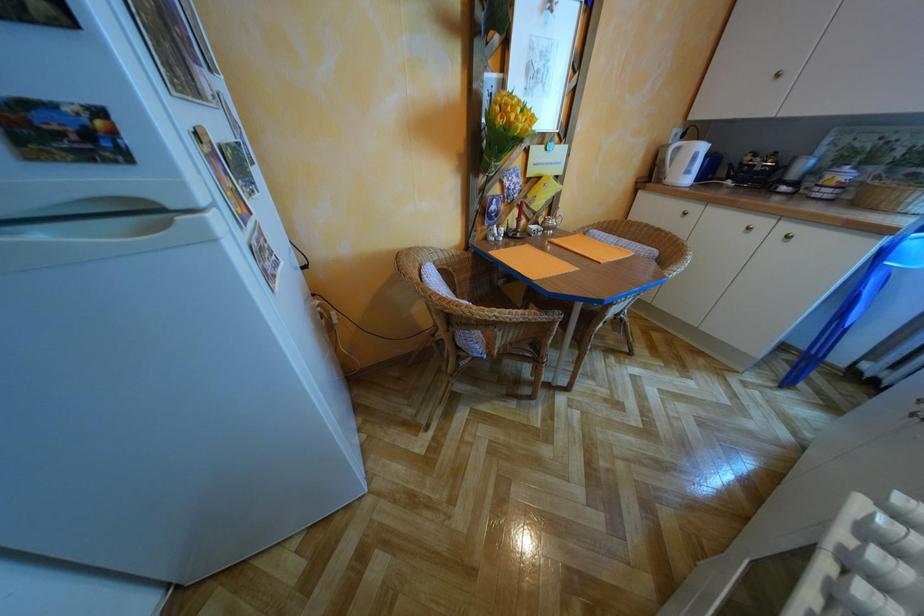
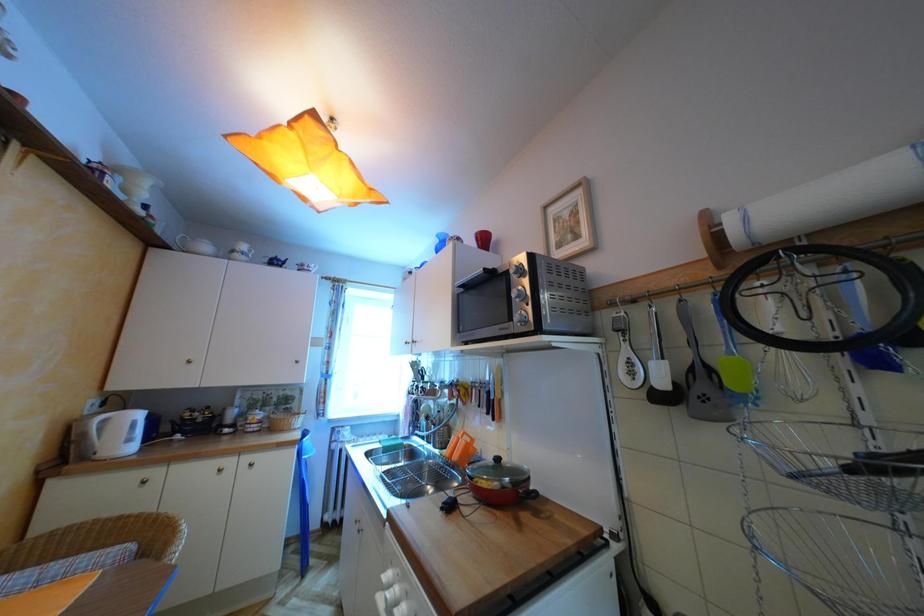
Question: How did the camera likely rotate?

Choices:
 (A) Left
 (B) Right
 (C) Up
 (D) Down

Answer: (B)